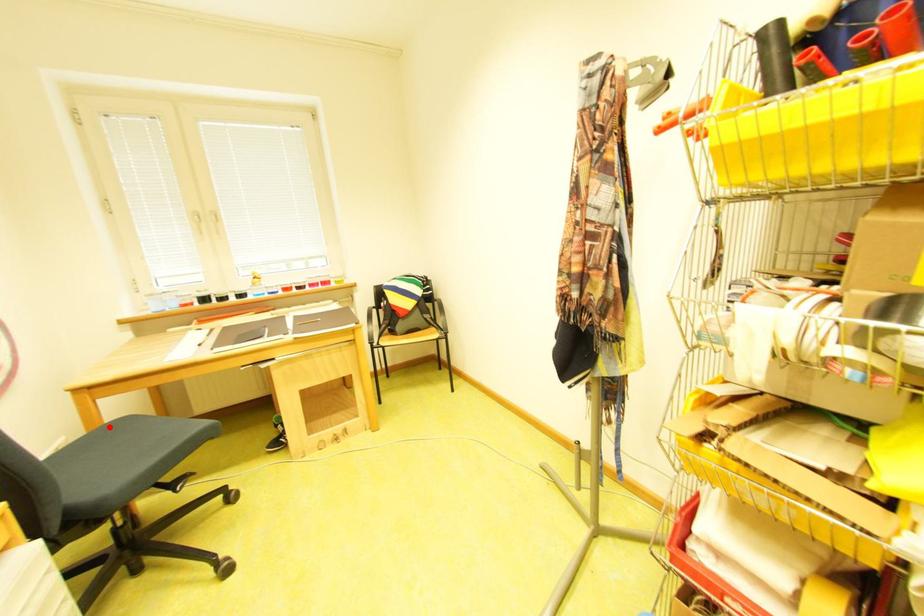
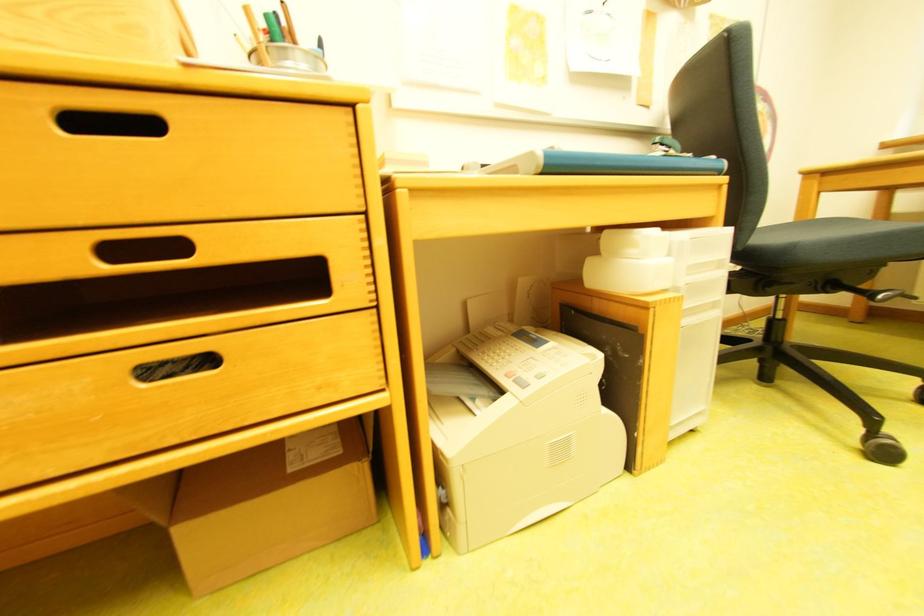
Find the pixel in the second image that matches the highlighted location in the first image.

(821, 220)